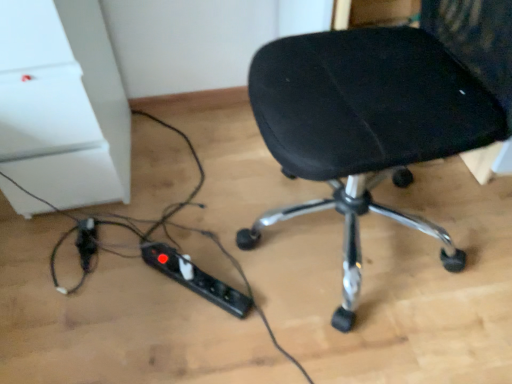
Question: Is black plastic extension cord at lower left, which appears as the 2th extension cord when viewed from the right, shorter than black plastic extension cord at lower center, acting as the 1th extension cord starting from the right?

Choices:
 (A) yes
 (B) no

Answer: (A)

Question: Can you confirm if black plastic extension cord at lower left, which appears as the 2th extension cord when viewed from the right, is taller than black plastic extension cord at lower center, the second extension cord when ordered from left to right?

Choices:
 (A) yes
 (B) no

Answer: (B)

Question: Does black plastic extension cord at lower left, which appears as the first extension cord when viewed from the left, have a greater width compared to black plastic extension cord at lower center, acting as the 1th extension cord starting from the right?

Choices:
 (A) yes
 (B) no

Answer: (B)

Question: Does black plastic extension cord at lower left, which appears as the first extension cord when viewed from the left, have a smaller size compared to black plastic extension cord at lower center, acting as the 1th extension cord starting from the right?

Choices:
 (A) no
 (B) yes

Answer: (B)

Question: Is black plastic extension cord at lower left, which appears as the 2th extension cord when viewed from the right, aimed at black plastic extension cord at lower center, acting as the 1th extension cord starting from the right?

Choices:
 (A) yes
 (B) no

Answer: (B)

Question: Relative to black fabric chair at center, is black plastic extension cord at lower left, which appears as the first extension cord when viewed from the left, in front or behind?

Choices:
 (A) behind
 (B) front

Answer: (A)

Question: Considering the positions of black plastic extension cord at lower left, which appears as the 2th extension cord when viewed from the right, and black fabric chair at center in the image, is black plastic extension cord at lower left, which appears as the 2th extension cord when viewed from the right, wider or thinner than black fabric chair at center?

Choices:
 (A) thin
 (B) wide

Answer: (A)

Question: From a real-world perspective, is black plastic extension cord at lower left, which appears as the first extension cord when viewed from the left, physically located above or below black fabric chair at center?

Choices:
 (A) above
 (B) below

Answer: (B)

Question: Would you say black plastic extension cord at lower left, which appears as the 2th extension cord when viewed from the right, is inside or outside black fabric chair at center?

Choices:
 (A) inside
 (B) outside

Answer: (B)

Question: From the image's perspective, is black plastic extension cord at lower left, which appears as the 2th extension cord when viewed from the right, above or below black plastic extension cord at lower center, the second extension cord when ordered from left to right?

Choices:
 (A) above
 (B) below

Answer: (A)

Question: From a real-world perspective, is black plastic extension cord at lower left, which appears as the 2th extension cord when viewed from the right, above or below black plastic extension cord at lower center, acting as the 1th extension cord starting from the right?

Choices:
 (A) above
 (B) below

Answer: (B)

Question: Looking at their shapes, would you say black plastic extension cord at lower left, which appears as the 2th extension cord when viewed from the right, is wider or thinner than black plastic extension cord at lower center, acting as the 1th extension cord starting from the right?

Choices:
 (A) thin
 (B) wide

Answer: (A)

Question: Is black plastic extension cord at lower left, which appears as the 2th extension cord when viewed from the right, taller or shorter than black plastic extension cord at lower center, acting as the 1th extension cord starting from the right?

Choices:
 (A) tall
 (B) short

Answer: (B)

Question: Considering the relative positions of black plastic extension cord at lower center, the second extension cord when ordered from left to right, and black fabric chair at center in the image provided, is black plastic extension cord at lower center, the second extension cord when ordered from left to right, to the left or to the right of black fabric chair at center?

Choices:
 (A) right
 (B) left

Answer: (B)

Question: Is point (148, 243) positioned closer to the camera than point (274, 107)?

Choices:
 (A) farther
 (B) closer

Answer: (A)